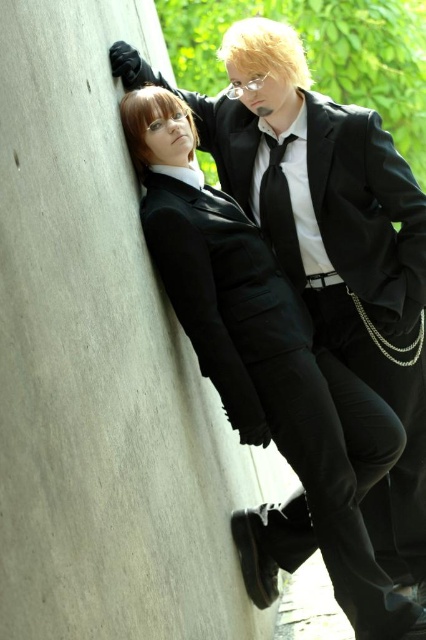
You are standing in front of a gray concrete wall at left and want to place a 3 meter long ladder against it. Can the ladder reach the top of the wall?

The gray concrete wall at left is 2.77 meters away from viewer. Since the ladder is 3 meters long, it can reach the top of the wall as its length exceeds the distance to the wall.

You are standing 20 feet away from a matte black suit at center. If you want to get closer to it, how many more feet do you need to walk forward?

The matte black suit at center is currently 21.08 feet away from you. To get closer, you need to walk forward 1.08 feet to reach the desired distance.